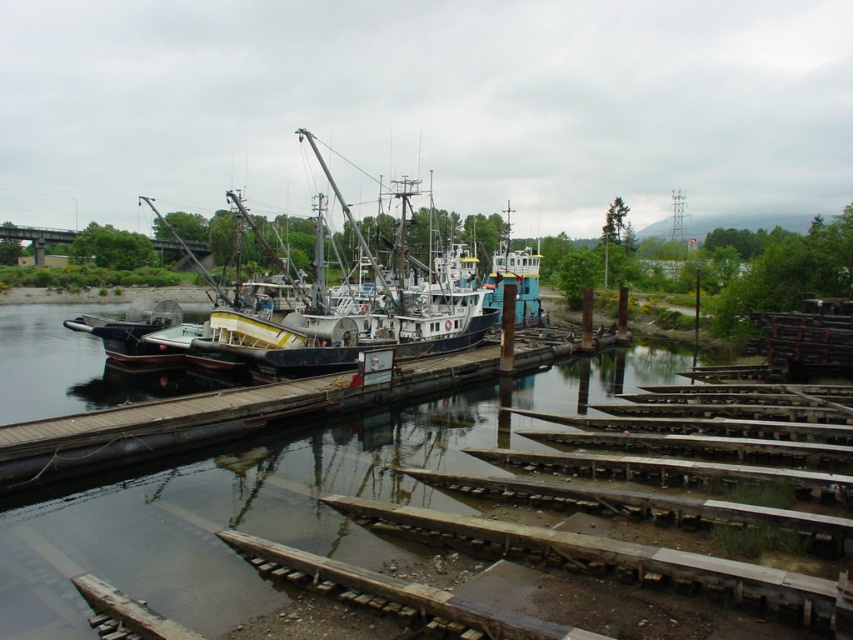
You are a dock inspector checking the condition of the marina. You notice the transparent water at center and the wooden at center. Which area should you prioritize inspecting for potential structural issues based on their visibility in the image?

The wooden at center should be prioritized for inspection because it occupies more space than the transparent water at center, indicating it may have more exposed areas needing attention.

You are standing at the edge of the wooden dock and want to take a photo of two specific points in the scene. The first point is located at coordinates point (224,410), and the second point is at point (194,333). Since you want both points to be in focus, which point should you focus on to ensure the other is also sharp?

You should focus on point (194,333) because it is farther from the camera than point (224,410). By focusing on the farther point, the near point will also be within the depth of field, ensuring both are sharp.

You are a dock worker checking the water level around the transparent water at center and the brushed metal boat at center. Which object is located below the other?

Result: The transparent water at center is positioned under the brushed metal boat at center, so the transparent water at center is below the brushed metal boat at center.